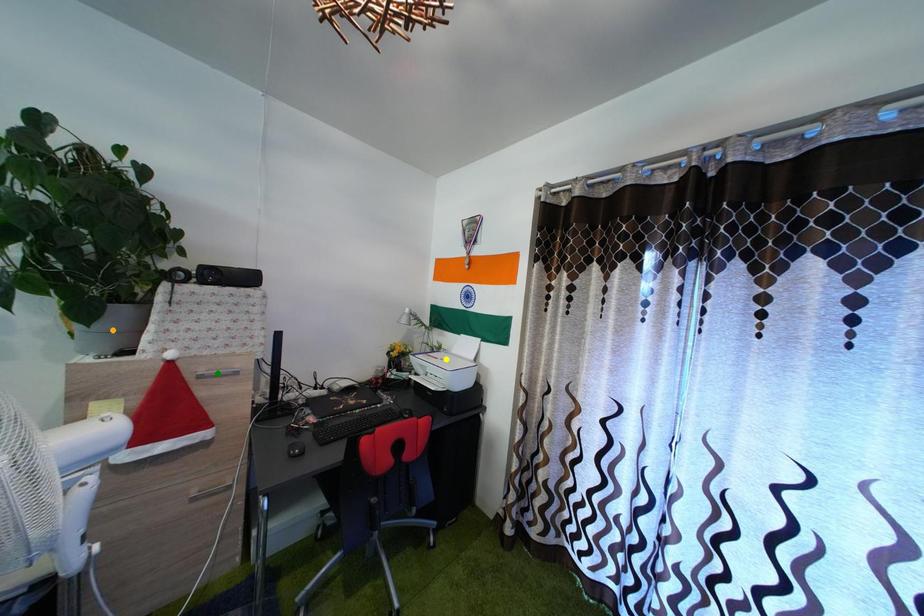
Order these from nearest to farthest:
1. orange point
2. green point
3. yellow point

1. orange point
2. green point
3. yellow point